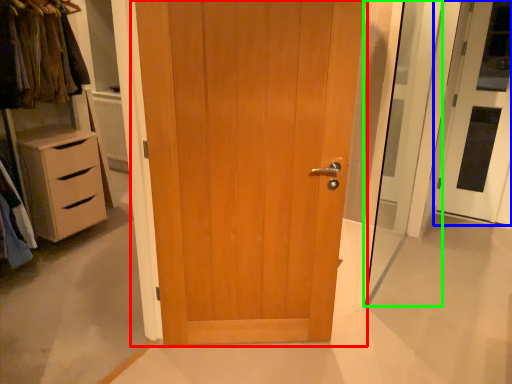
Question: Based on their relative distances, which object is farther from door (highlighted by a red box)? Choose from door (highlighted by a blue box) and screen door (highlighted by a green box).

Choices:
 (A) door
 (B) screen door

Answer: (A)